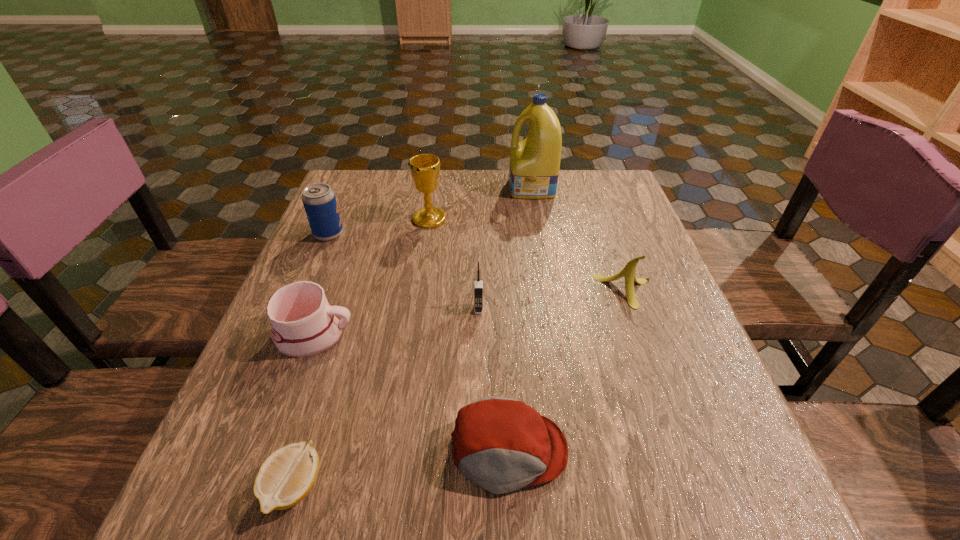
Identify the location of the farthest object. The width and height of the screenshot is (960, 540). (535, 161).

In order to click on the tallest object in this screenshot , I will do `click(535, 161)`.

What are the coordinates of `the fifth object from right to left` in the screenshot? It's located at (425, 168).

Locate an element on the screen. Image resolution: width=960 pixels, height=540 pixels. the second tallest object is located at coordinates (425, 168).

In order to click on beer can in this screenshot , I will do click(x=319, y=200).

Identify the location of cellular telephone. This screenshot has height=540, width=960. (478, 283).

Find the location of a particular element. The image size is (960, 540). banana is located at coordinates (628, 272).

Locate an element on the screen. The image size is (960, 540). mug is located at coordinates (303, 323).

Locate an element on the screen. cap is located at coordinates (501, 444).

This screenshot has height=540, width=960. Identify the location of the shortest object. (286, 477).